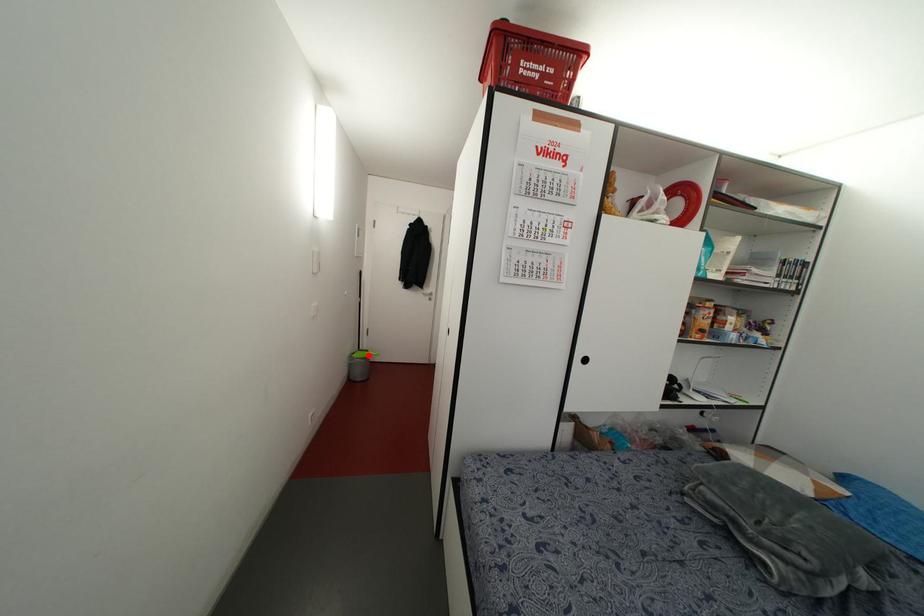
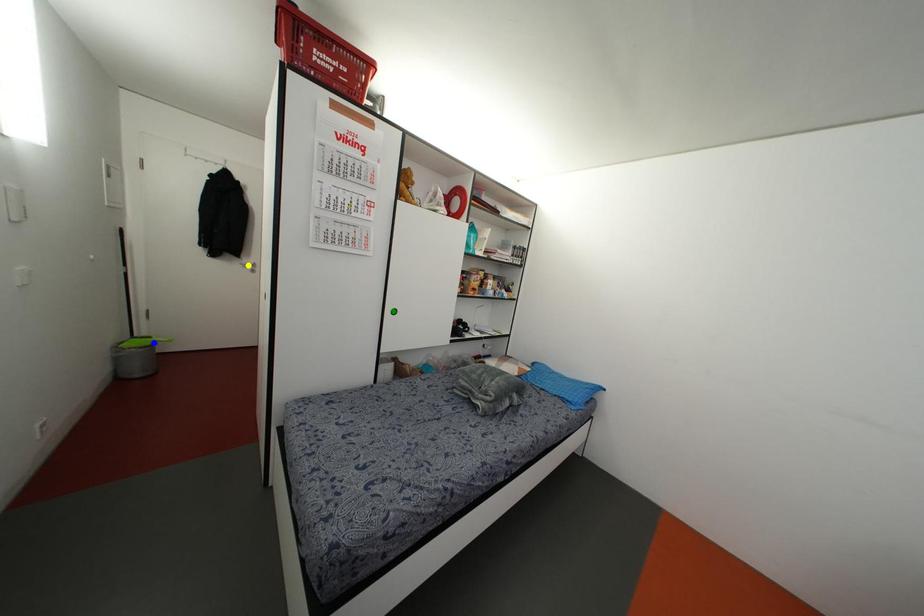
Question: I am providing you with two images of the same scene from different viewpoints. A red point is marked on the first image. You are given multiple points on the second image. Which point in image 2 represents the same 3d spot as the red point in image 1?

Choices:
 (A) yellow point
 (B) blue point
 (C) green point

Answer: (B)